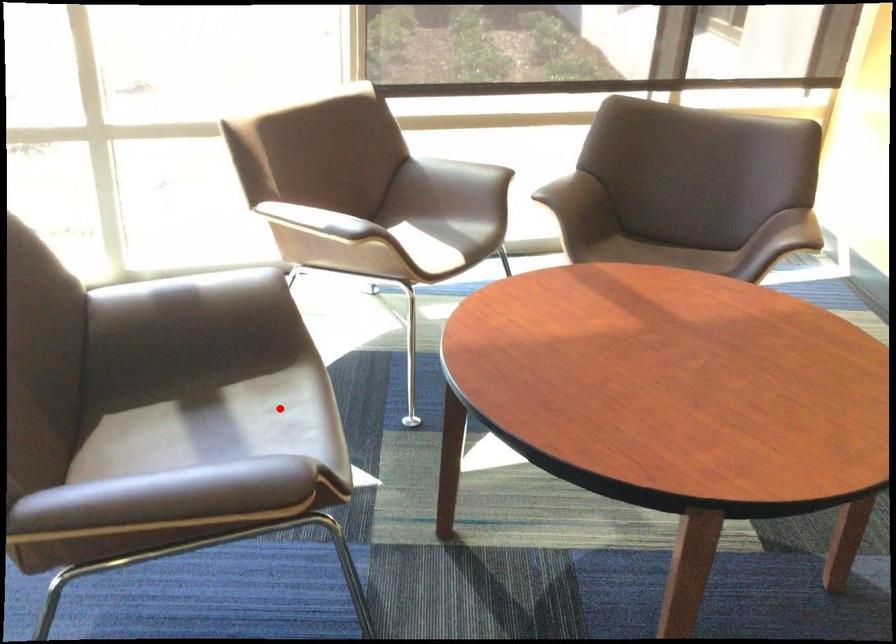
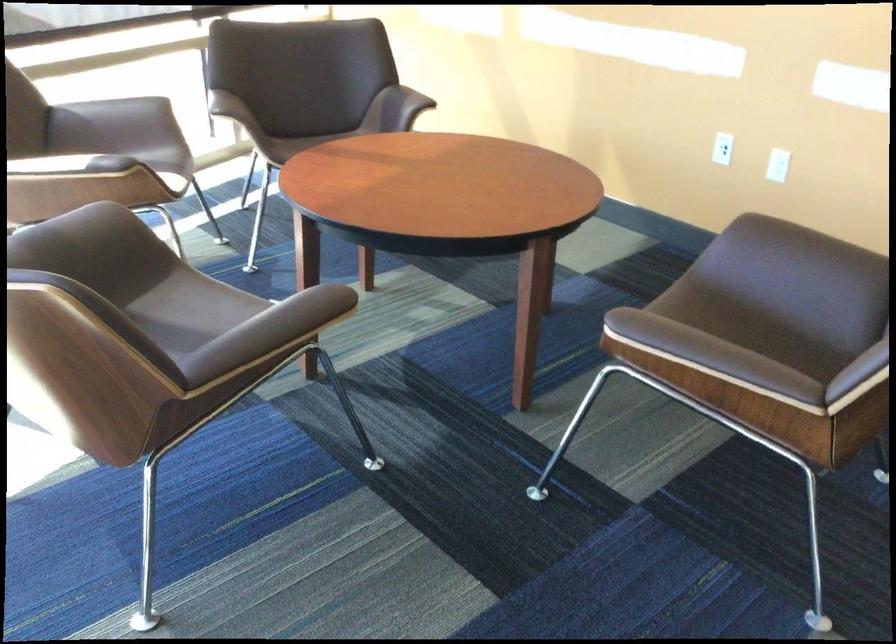
Question: I am providing you with two images of the same scene from different viewpoints. Image1 has a red point marked. In image2, the corresponding 3D location appears at what relative position? Reply with the corresponding letter.

Choices:
 (A) Closer
 (B) Farther

Answer: (B)